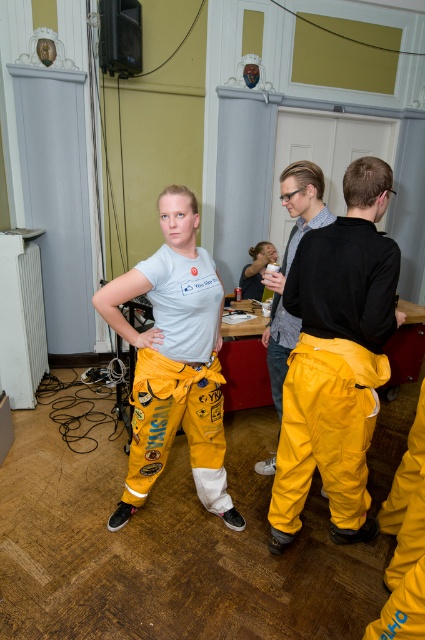
What are the coordinates of the yellow fabric pants at center?

The yellow fabric pants at center are located at coordinates point (175, 360).

You are a fashion designer analyzing the clothing items in the image. Which clothing item, the yellow fabric pants at center or the matte black shirt at center, would be more suitable for a design that requires a larger fabric area? Please explain your reasoning based on the provided information.

The yellow fabric pants at center would be more suitable for a design requiring a larger fabric area since it has a larger size compared to the matte black shirt at center.